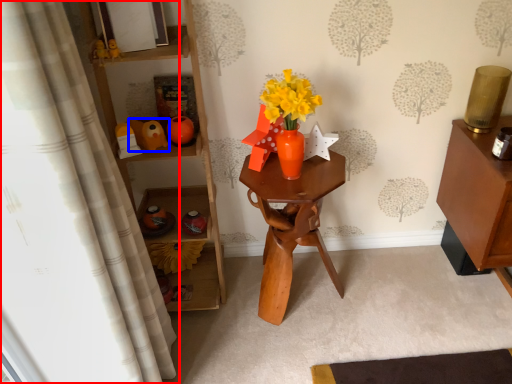
Question: Which object appears closest to the camera in this image, curtain (highlighted by a red box) or toy (highlighted by a blue box)?

Choices:
 (A) curtain
 (B) toy

Answer: (A)